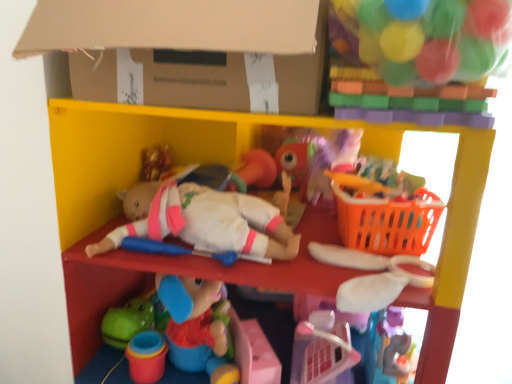
Question: Is the depth of translucent plastic balls at upper right, which is counted as the second toy, starting from the bottom, less than that of orange plastic basket at right?

Choices:
 (A) yes
 (B) no

Answer: (A)

Question: Is translucent plastic balls at upper right, placed as the 1th toy when sorted from top to bottom, at the right side of orange plastic basket at right?

Choices:
 (A) yes
 (B) no

Answer: (B)

Question: Is translucent plastic balls at upper right, which is counted as the second toy, starting from the bottom, at the left side of orange plastic basket at right?

Choices:
 (A) yes
 (B) no

Answer: (A)

Question: Is translucent plastic balls at upper right, placed as the 1th toy when sorted from top to bottom, touching orange plastic basket at right?

Choices:
 (A) yes
 (B) no

Answer: (B)

Question: Is translucent plastic balls at upper right, which is counted as the second toy, starting from the bottom, not close to orange plastic basket at right?

Choices:
 (A) no
 (B) yes

Answer: (A)

Question: Could you tell me if translucent plastic balls at upper right, which is counted as the second toy, starting from the bottom, is turned towards orange plastic basket at right?

Choices:
 (A) yes
 (B) no

Answer: (B)

Question: Are smooth plastic shelf at center and white fabric bow at upper right, acting as the 2th toy starting from the top, beside each other?

Choices:
 (A) yes
 (B) no

Answer: (B)

Question: Is white fabric bow at upper right, the 1th toy in the bottom-to-top sequence, completely or partially inside smooth plastic shelf at center?

Choices:
 (A) no
 (B) yes

Answer: (B)

Question: Is smooth plastic shelf at center taller than white fabric bow at upper right, acting as the 2th toy starting from the top?

Choices:
 (A) yes
 (B) no

Answer: (A)

Question: From a real-world perspective, is smooth plastic shelf at center beneath white fabric bow at upper right, acting as the 2th toy starting from the top?

Choices:
 (A) no
 (B) yes

Answer: (B)

Question: Is smooth plastic shelf at center closer to camera compared to white fabric bow at upper right, the 1th toy in the bottom-to-top sequence?

Choices:
 (A) no
 (B) yes

Answer: (B)

Question: From the image's perspective, does smooth plastic shelf at center appear lower than white fabric bow at upper right, acting as the 2th toy starting from the top?

Choices:
 (A) yes
 (B) no

Answer: (A)

Question: Is orange plastic basket at right at the right side of cardboard at upper center?

Choices:
 (A) yes
 (B) no

Answer: (A)